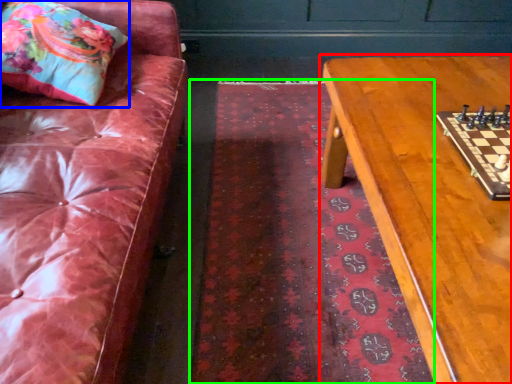
Question: Which is farther away from table (highlighted by a red box)? throw pillow (highlighted by a blue box) or mat (highlighted by a green box)?

Choices:
 (A) throw pillow
 (B) mat

Answer: (A)